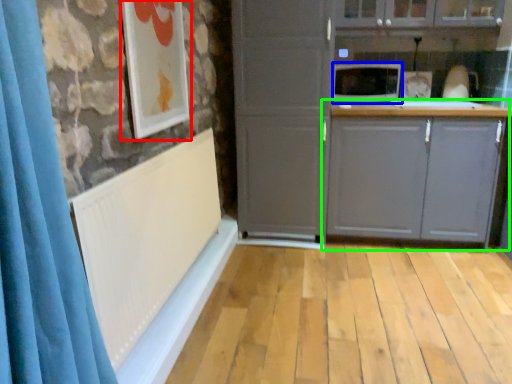
Question: Based on their relative distances, which object is nearer to picture frame (highlighted by a red box)? Choose from microwave oven (highlighted by a blue box) and cabinetry (highlighted by a green box).

Choices:
 (A) microwave oven
 (B) cabinetry

Answer: (A)